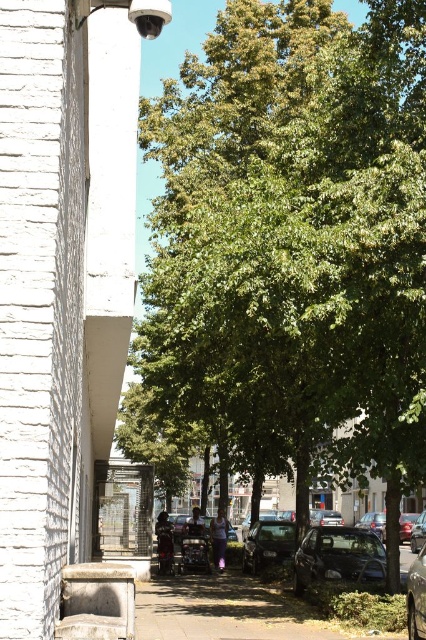
Question: Which object is the farthest from the metallic silver car at center?

Choices:
 (A) shiny black sedan at center
 (B) green leafy tree at center
 (C) brown concrete sidewalk at center

Answer: (A)

Question: Which point appears farthest from the camera in this image?

Choices:
 (A) (271, 611)
 (B) (232, 550)
 (C) (275, 108)

Answer: (B)

Question: Can you confirm if metallic silver car at center is thinner than shiny black sedan at center?

Choices:
 (A) yes
 (B) no

Answer: (A)

Question: Can you confirm if brown concrete sidewalk at center is bigger than metallic silver car at center?

Choices:
 (A) no
 (B) yes

Answer: (B)

Question: Can you confirm if green leafy tree at center is positioned to the left of shiny black sedan at center?

Choices:
 (A) no
 (B) yes

Answer: (B)

Question: Among these points, which one is nearest to the camera?

Choices:
 (A) (324, 534)
 (B) (232, 532)

Answer: (A)